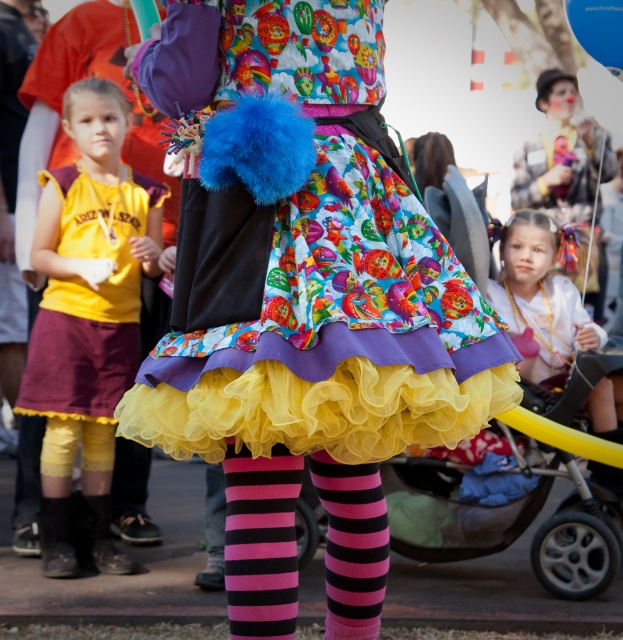
Question: From the image, what is the correct spatial relationship of multicolored fabric dress at center in relation to pastel hairband at upper center?

Choices:
 (A) right
 (B) left

Answer: (B)

Question: Which of the following is the farthest from the observer?

Choices:
 (A) (93, 324)
 (B) (462, 529)

Answer: (B)

Question: Based on their relative distances, which object is nearer to the pastel hairband at upper center?

Choices:
 (A) yellow jersey at left
 (B) multicolored fabric dress at center
 (C) yellow fabric baby carriage at lower center
 (D) blue fabric balloon at upper right

Answer: (C)

Question: Which of the following is the closest to the observer?

Choices:
 (A) (388, 496)
 (B) (592, 32)
 (C) (72, 433)

Answer: (C)

Question: Is the position of pastel hairband at upper center more distant than that of matte yellow dress at center?

Choices:
 (A) no
 (B) yes

Answer: (A)

Question: Can you confirm if multicolored fabric dress at center is positioned above pastel hairband at upper center?

Choices:
 (A) yes
 (B) no

Answer: (A)